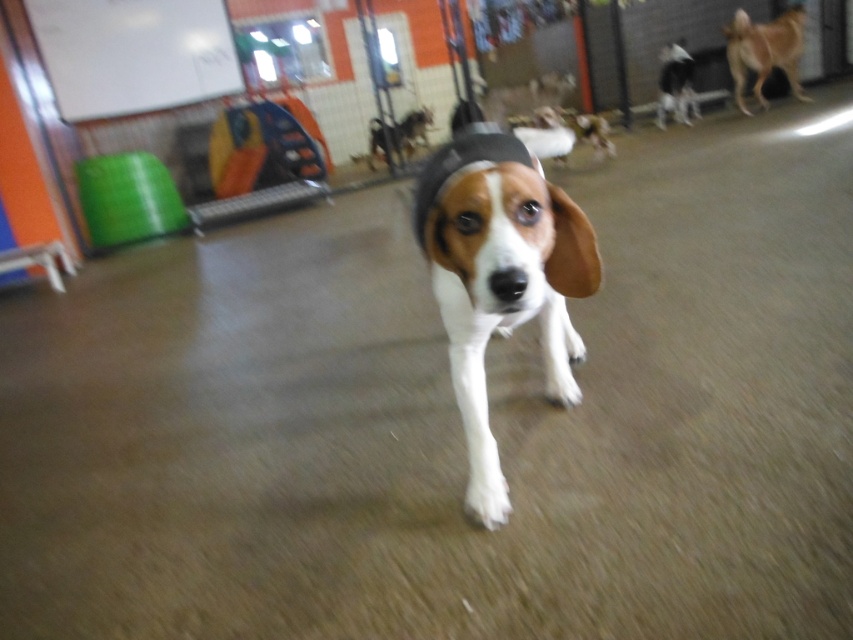
Question: Which object is farther from the camera taking this photo?

Choices:
 (A) tri-color fur dog at center
 (B) white fur dog at upper right
 (C) brown fur dog at upper right

Answer: (B)

Question: From the image, what is the correct spatial relationship of brown fur dog at upper right in relation to white fur dog at upper right?

Choices:
 (A) below
 (B) above

Answer: (B)

Question: Can you confirm if tri-color fur dog at center is positioned below brown fur dog at upper right?

Choices:
 (A) yes
 (B) no

Answer: (A)

Question: Considering the real-world distances, which object is farthest from the white fur dog at upper right?

Choices:
 (A) brown fur dog at upper right
 (B) tri-color fur dog at center

Answer: (B)

Question: Is tri-color fur dog at center smaller than white fur dog at upper right?

Choices:
 (A) yes
 (B) no

Answer: (B)

Question: Estimate the real-world distances between objects in this image. Which object is farther from the brown fur dog at upper right?

Choices:
 (A) white fur dog at upper right
 (B) tri-color fur dog at center

Answer: (B)